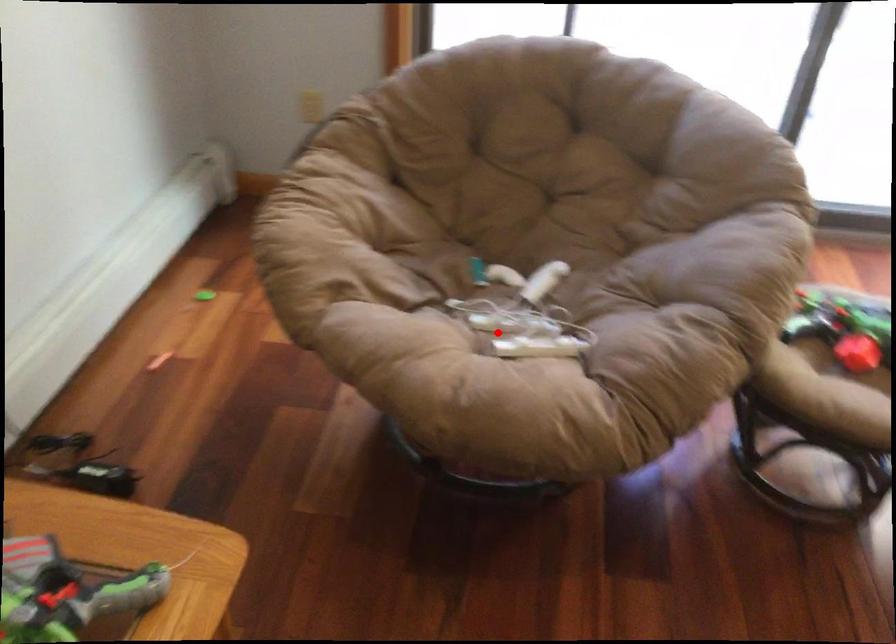
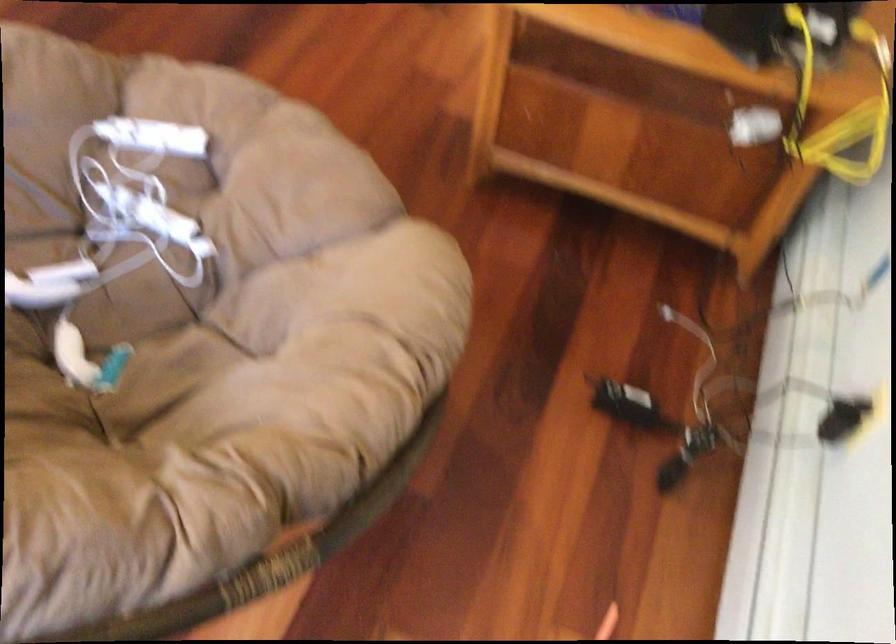
The point at the highlighted location is marked in the first image. Where is the corresponding point in the second image?

(181, 205)